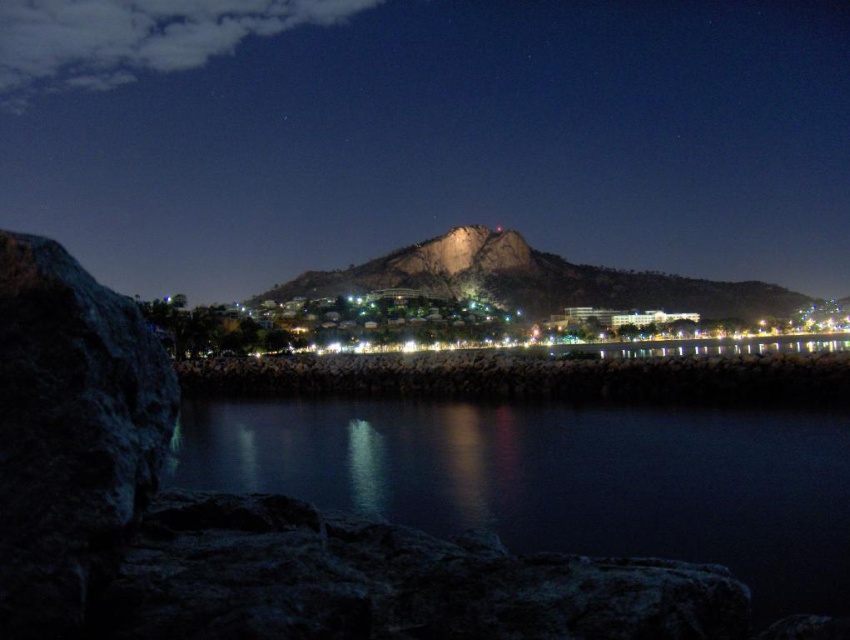
Between smooth dark water at center and rocky brown mountain at center, which one appears on the right side from the viewer's perspective?

rocky brown mountain at center is more to the right.

Is point (799, 448) positioned in front of point (707, 305)?

Yes, it is.

At what (x,y) coordinates should I click in order to perform the action: click on smooth dark water at center. Please return your answer as a coordinate pair (x, y). Image resolution: width=850 pixels, height=640 pixels. Looking at the image, I should click on (557, 477).

Can you confirm if rocky cliff at left is thinner than smooth dark water at center?

In fact, rocky cliff at left might be wider than smooth dark water at center.

In the scene shown: Is rocky cliff at left closer to camera compared to smooth dark water at center?

No, it is not.

Does point (289, 202) lie in front of point (802, 573)?

No.

Identify the location of rocky cliff at left. Image resolution: width=850 pixels, height=640 pixels. (428, 132).

Does rocky cliff at left have a greater height compared to rocky brown mountain at center?

Yes, rocky cliff at left is taller than rocky brown mountain at center.

Does rocky cliff at left have a lesser height compared to rocky brown mountain at center?

In fact, rocky cliff at left may be taller than rocky brown mountain at center.

Describe the element at coordinates (428, 132) in the screenshot. I see `rocky cliff at left` at that location.

The height and width of the screenshot is (640, 850). I want to click on rocky cliff at left, so click(428, 132).